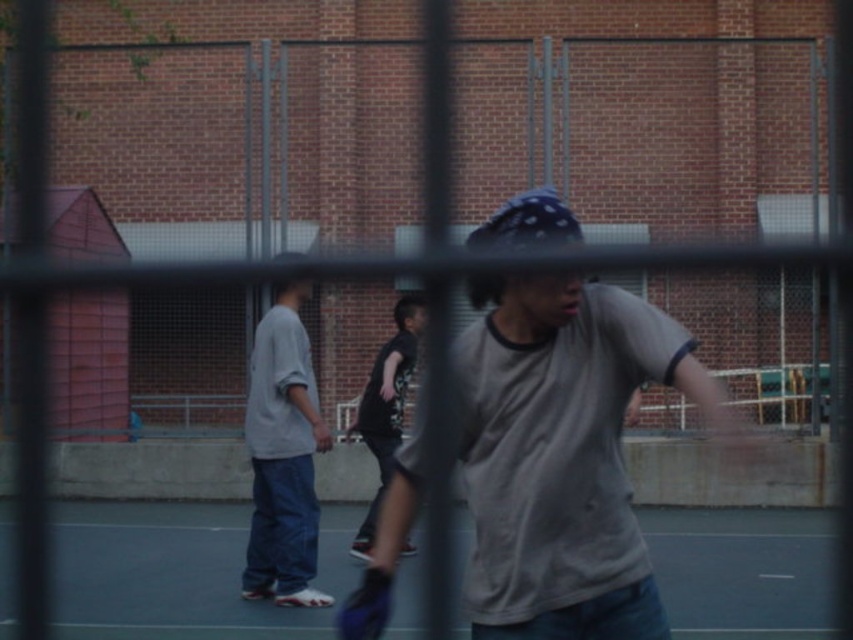
You are standing at the camera position and want to throw a ball to the light gray cotton shirt at left. Is the distance within the range of a typical basketball throw?

The distance between the light gray cotton shirt at left and the camera is 8.25 meters. A typical basketball throw has a range of about 6 to 7 meters, so the throw would be too far.